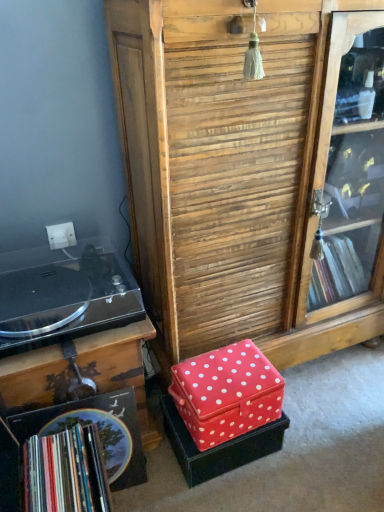
Question: Is point (226, 373) closer or farther from the camera than point (276, 426)?

Choices:
 (A) farther
 (B) closer

Answer: (B)

Question: Considering the positions of red fabric box at lower center, which is the 1th storage box from top to bottom, and red fabric box at center, the first storage box positioned from the bottom, in the image, is red fabric box at lower center, which is the 1th storage box from top to bottom, taller or shorter than red fabric box at center, the first storage box positioned from the bottom,?

Choices:
 (A) tall
 (B) short

Answer: (A)

Question: Estimate the real-world distances between objects in this image. Which object is farther from the black plastic record player at left?

Choices:
 (A) red fabric box at center, the first storage box positioned from the bottom
 (B) multicolored paper book at lower left
 (C) red fabric box at lower center, which is the 2th storage box in bottom-to-top order
 (D) wooden at center

Answer: (D)

Question: Which of these objects is positioned closest to the red fabric box at center, the first storage box positioned from the bottom?

Choices:
 (A) multicolored paper book at lower left
 (B) red fabric box at lower center, which is the 1th storage box from top to bottom
 (C) black plastic record player at left
 (D) wooden at center

Answer: (B)